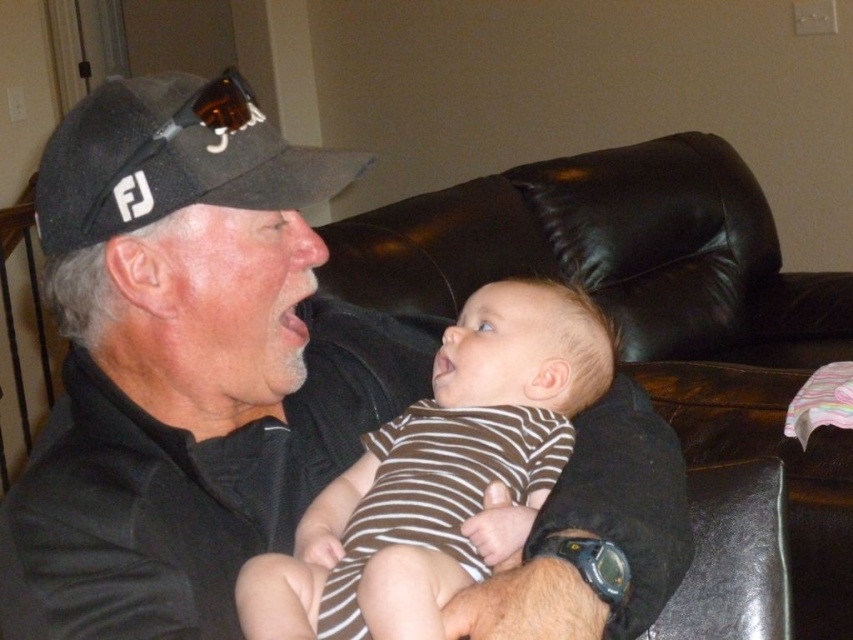
Question: Which object is farther from the camera taking this photo?

Choices:
 (A) brown striped onesie at center
 (B) black fabric baseball cap at upper left

Answer: (B)

Question: Does black leather couch at center appear over brown striped onesie at center?

Choices:
 (A) no
 (B) yes

Answer: (B)

Question: Which point is closer to the camera?

Choices:
 (A) (442, 563)
 (B) (154, 326)
 (C) (532, 266)

Answer: (A)

Question: Is black matte cap at upper left further to camera compared to black fabric baseball cap at upper left?

Choices:
 (A) no
 (B) yes

Answer: (A)

Question: Which point is farther from the camera taking this photo?

Choices:
 (A) (511, 490)
 (B) (621, 244)
 (C) (157, 179)
 (D) (106, 173)

Answer: (B)

Question: From the image, what is the correct spatial relationship of black matte cap at upper left in relation to black leather couch at center?

Choices:
 (A) below
 (B) above

Answer: (A)